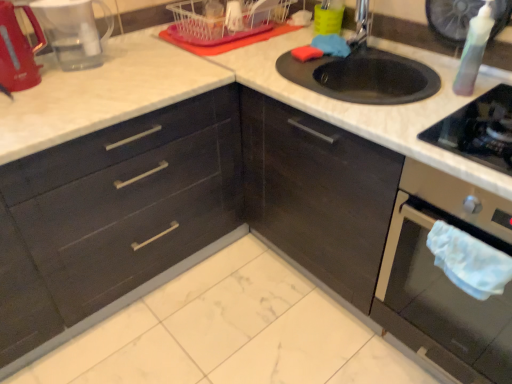
Question: Is matte black drawers at left thinner than transparent plastic bottle at upper right, the second appliance in the left-to-right sequence?

Choices:
 (A) no
 (B) yes

Answer: (A)

Question: Does matte black drawers at left lie in front of transparent plastic bottle at upper right, the second appliance in the left-to-right sequence?

Choices:
 (A) no
 (B) yes

Answer: (B)

Question: Does matte black drawers at left have a smaller size compared to transparent plastic bottle at upper right, the second appliance in the left-to-right sequence?

Choices:
 (A) no
 (B) yes

Answer: (A)

Question: Is matte black drawers at left facing away from transparent plastic bottle at upper right, the second appliance in the left-to-right sequence?

Choices:
 (A) no
 (B) yes

Answer: (A)

Question: Is matte black drawers at left positioned beyond the bounds of transparent plastic bottle at upper right, the second appliance in the left-to-right sequence?

Choices:
 (A) no
 (B) yes

Answer: (B)

Question: Is matte black drawers at left directly adjacent to transparent plastic bottle at upper right, acting as the first appliance starting from the right?

Choices:
 (A) yes
 (B) no

Answer: (B)

Question: Is white plastic basket at upper center in front of matte black oven at lower right?

Choices:
 (A) no
 (B) yes

Answer: (A)

Question: From the image's perspective, is white plastic basket at upper center under matte black oven at lower right?

Choices:
 (A) no
 (B) yes

Answer: (A)

Question: Is white plastic basket at upper center at the right side of matte black oven at lower right?

Choices:
 (A) no
 (B) yes

Answer: (A)

Question: Are white plastic basket at upper center and matte black oven at lower right making contact?

Choices:
 (A) no
 (B) yes

Answer: (A)

Question: Is white plastic basket at upper center not within matte black oven at lower right?

Choices:
 (A) yes
 (B) no

Answer: (A)

Question: Is matte black oven at lower right located within white plastic basket at upper center?

Choices:
 (A) no
 (B) yes

Answer: (A)

Question: Is metallic silver faucet at upper right looking in the opposite direction of matte black oven at lower right?

Choices:
 (A) no
 (B) yes

Answer: (A)